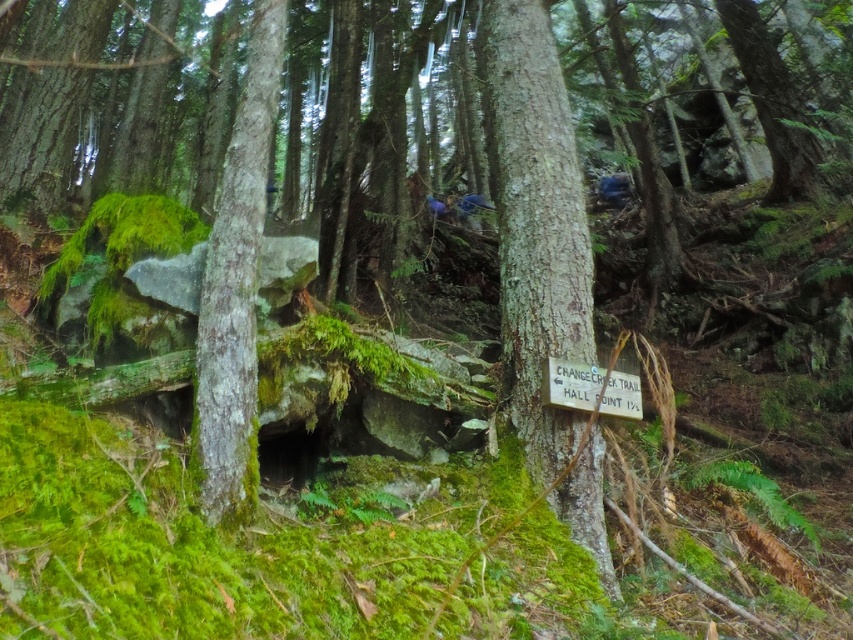
Question: Is smooth bark tree trunk at center below green mossy bark at center?

Choices:
 (A) yes
 (B) no

Answer: (B)

Question: Can you confirm if smooth bark tree trunk at center is positioned to the left of green mossy bark at center?

Choices:
 (A) yes
 (B) no

Answer: (B)

Question: Does smooth bark tree trunk at center appear over green mossy bark at center?

Choices:
 (A) yes
 (B) no

Answer: (A)

Question: Which object is farther from the camera taking this photo?

Choices:
 (A) green mossy bark at center
 (B) smooth bark tree trunk at center

Answer: (B)

Question: Which point is farther to the camera?

Choices:
 (A) (259, 48)
 (B) (503, 186)

Answer: (B)